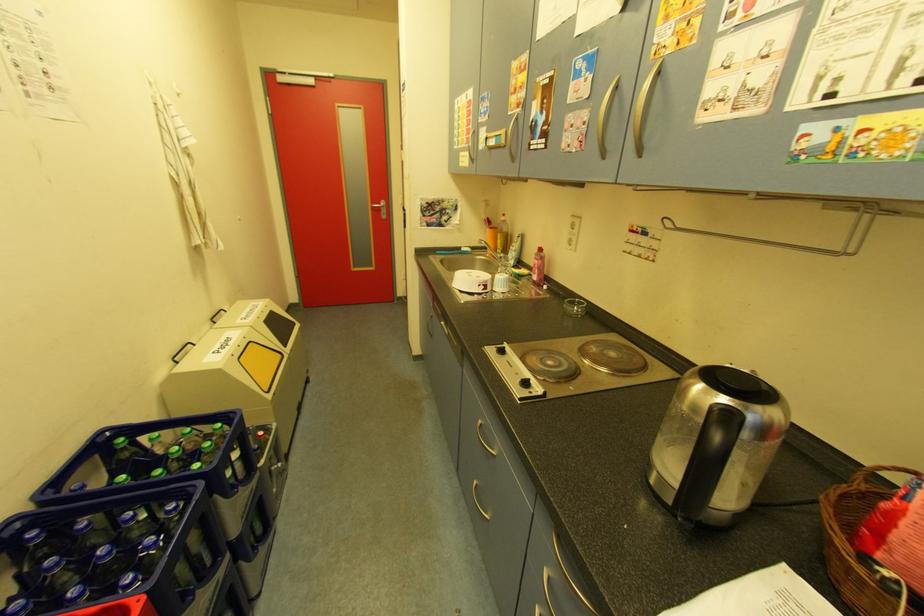
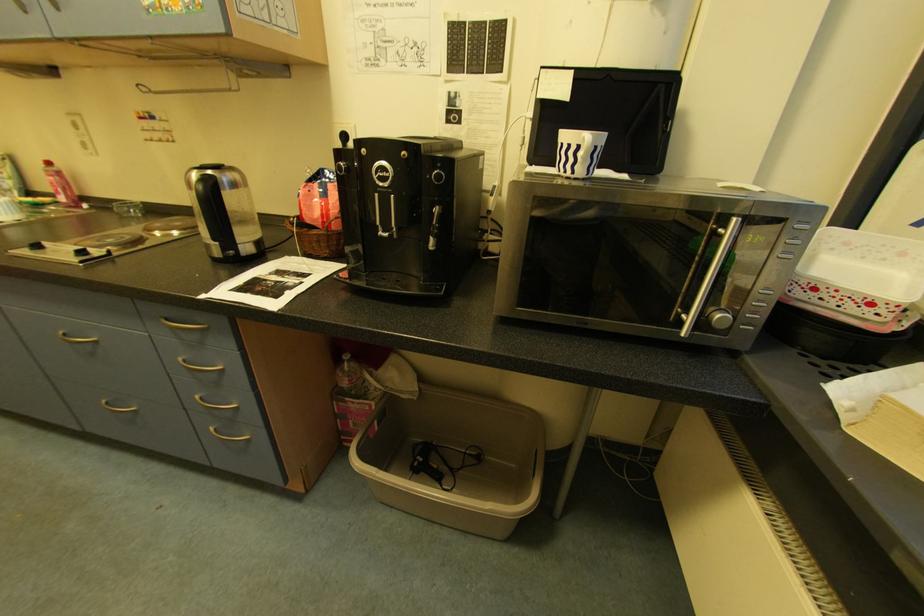
Based on the continuous images, in which direction is the camera rotating?

The rotation direction of the camera is right-down.